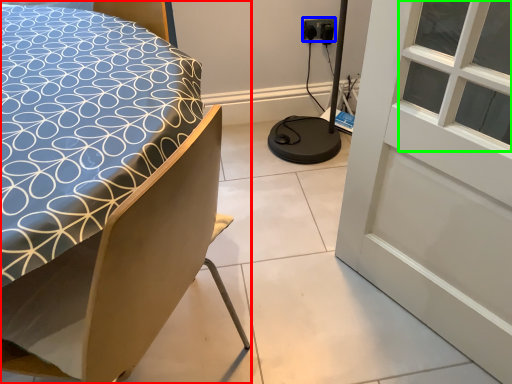
Question: Considering the real-world distances, which object is farthest from bed (highlighted by a red box)? electric outlet (highlighted by a blue box) or window (highlighted by a green box)?

Choices:
 (A) electric outlet
 (B) window

Answer: (A)